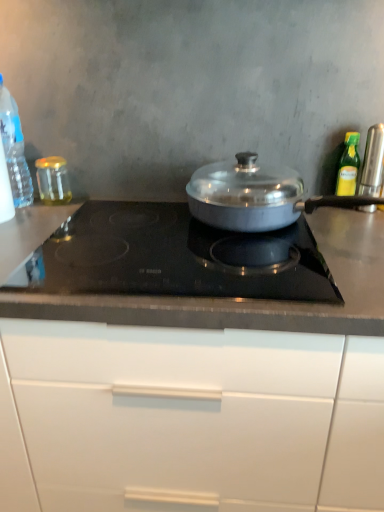
The image size is (384, 512). Find the location of `free location above black glass cooktop at center (from a real-world perspective)`. free location above black glass cooktop at center (from a real-world perspective) is located at coordinates (167, 242).